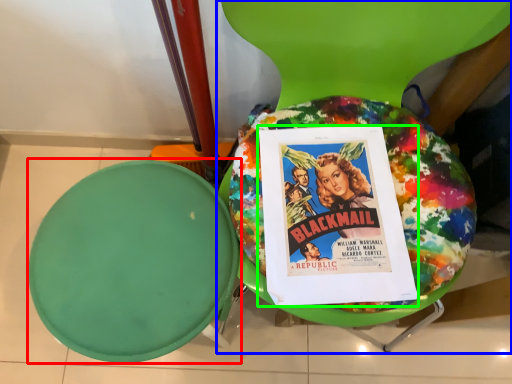
Question: Estimate the real-world distances between objects in this image. Which object is farther from round table (highlighted by a red box), chair (highlighted by a blue box) or comic book (highlighted by a green box)?

Choices:
 (A) chair
 (B) comic book

Answer: (A)